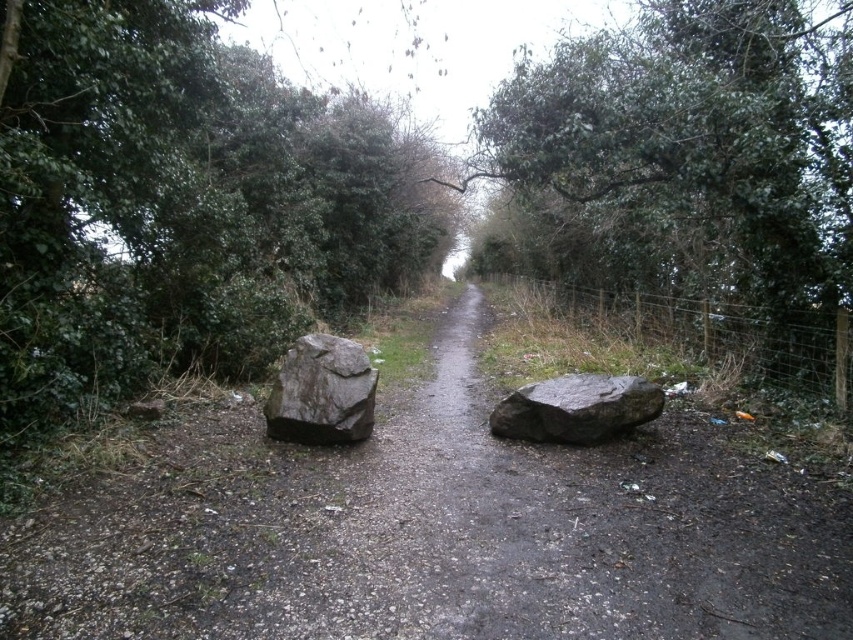
Between point (393, 243) and point (692, 268), which one is positioned in front?

Point (692, 268) is in front.

Does green leafy tree at left lie behind green leafy tree at center?

That is False.

Does point (393, 236) lie in front of point (730, 81)?

No, (393, 236) is further to viewer.

The width and height of the screenshot is (853, 640). I want to click on green leafy tree at left, so click(180, 204).

Which of these two, green leafy tree at left or gray rough boulder at center, stands taller?

Standing taller between the two is green leafy tree at left.

Which is in front, point (25, 184) or point (518, 401)?

Point (25, 184) is in front.

Is point (62, 13) in front of point (512, 429)?

Yes, point (62, 13) is in front of point (512, 429).

The image size is (853, 640). I want to click on green leafy tree at left, so [180, 204].

Image resolution: width=853 pixels, height=640 pixels. Describe the element at coordinates (689, 164) in the screenshot. I see `green leafy tree at center` at that location.

Who is more distant from viewer, [694,177] or [602,376]?

Point [602,376]

Where is `green leafy tree at center`? The width and height of the screenshot is (853, 640). green leafy tree at center is located at coordinates (689, 164).

In order to click on green leafy tree at center in this screenshot , I will do `click(689, 164)`.